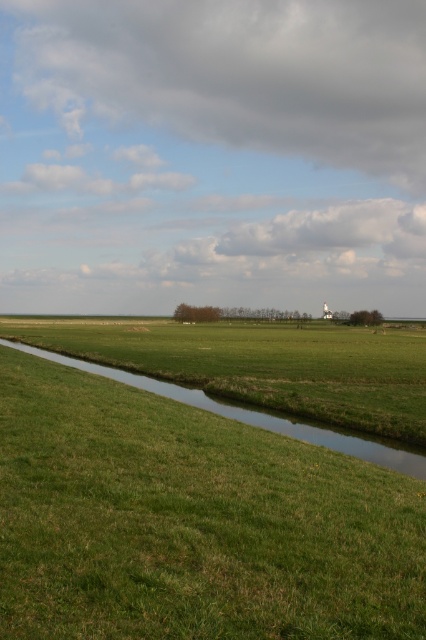
In the scene shown: Between green grassy field at center and green grassy stream at lower center, which one appears on the left side from the viewer's perspective?

green grassy stream at lower center is more to the left.

Does green grassy field at center appear under green grassy stream at lower center?

No, green grassy field at center is not below green grassy stream at lower center.

Identify the location of green grassy field at center. This screenshot has height=640, width=426. (190, 522).

Locate an element on the screen. The height and width of the screenshot is (640, 426). green grassy field at center is located at coordinates (190, 522).